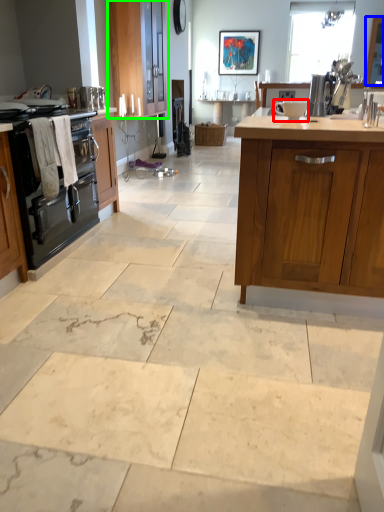
Question: Which is nearer to the appliance (highlighted by a red box)? window screen (highlighted by a blue box) or cabinetry (highlighted by a green box).

Choices:
 (A) window screen
 (B) cabinetry

Answer: (A)